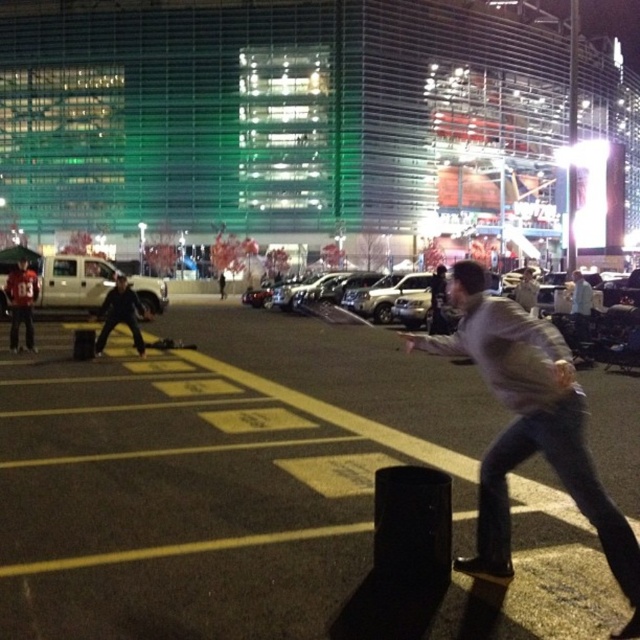
Which is above, black rubber pole at center or light gray sweater at center?

light gray sweater at center is higher up.

What do you see at coordinates (260, 492) in the screenshot?
I see `black rubber pole at center` at bounding box center [260, 492].

Image resolution: width=640 pixels, height=640 pixels. I want to click on black rubber pole at center, so click(x=260, y=492).

Can you confirm if gray matte skateboard at lower right is wider than light gray sweater at center?

In fact, gray matte skateboard at lower right might be narrower than light gray sweater at center.

Is point (508, 358) in front of point (524, 300)?

Yes, it is.

What are the coordinates of `gray matte skateboard at lower right` in the screenshot? It's located at click(x=529, y=428).

Can you confirm if black rubber pole at center is wider than dark gray hoodie at center-left?

Correct, the width of black rubber pole at center exceeds that of dark gray hoodie at center-left.

Locate an element on the screen. This screenshot has height=640, width=640. black rubber pole at center is located at coordinates (260, 492).

Where is `black rubber pole at center`? The width and height of the screenshot is (640, 640). black rubber pole at center is located at coordinates (260, 492).